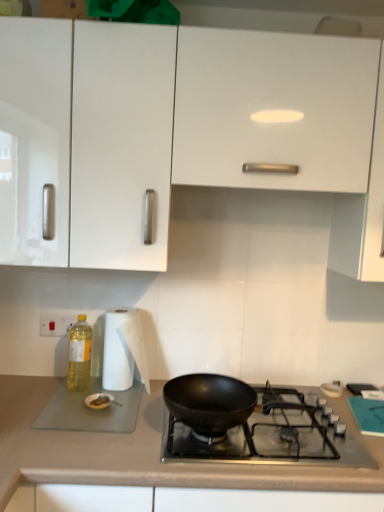
Question: Is black matte wok at center shorter than yellow translucent bottle at left?

Choices:
 (A) no
 (B) yes

Answer: (B)

Question: Considering the relative sizes of black matte wok at center and yellow translucent bottle at left in the image provided, is black matte wok at center thinner than yellow translucent bottle at left?

Choices:
 (A) no
 (B) yes

Answer: (A)

Question: Considering the relative positions of black matte wok at center and yellow translucent bottle at left in the image provided, is black matte wok at center to the right of yellow translucent bottle at left from the viewer's perspective?

Choices:
 (A) yes
 (B) no

Answer: (A)

Question: Does black matte wok at center have a smaller size compared to yellow translucent bottle at left?

Choices:
 (A) yes
 (B) no

Answer: (B)

Question: Is black matte wok at center completely or partially outside of yellow translucent bottle at left?

Choices:
 (A) no
 (B) yes

Answer: (B)

Question: Are black matte wok at center and yellow translucent bottle at left far apart?

Choices:
 (A) no
 (B) yes

Answer: (A)

Question: Does smooth beige countertop at lower center have a lesser width compared to white plastic electric outlet at lower left?

Choices:
 (A) no
 (B) yes

Answer: (A)

Question: Considering the relative positions of smooth beige countertop at lower center and white plastic electric outlet at lower left in the image provided, is smooth beige countertop at lower center to the left of white plastic electric outlet at lower left from the viewer's perspective?

Choices:
 (A) yes
 (B) no

Answer: (B)

Question: Are smooth beige countertop at lower center and white plastic electric outlet at lower left making contact?

Choices:
 (A) no
 (B) yes

Answer: (A)

Question: From a real-world perspective, is smooth beige countertop at lower center physically above white plastic electric outlet at lower left?

Choices:
 (A) no
 (B) yes

Answer: (A)

Question: Does smooth beige countertop at lower center appear on the right side of white plastic electric outlet at lower left?

Choices:
 (A) yes
 (B) no

Answer: (A)

Question: Is smooth beige countertop at lower center completely or partially outside of white plastic electric outlet at lower left?

Choices:
 (A) no
 (B) yes

Answer: (B)

Question: Is black matte wok at center behind white paper towel at left?

Choices:
 (A) yes
 (B) no

Answer: (B)